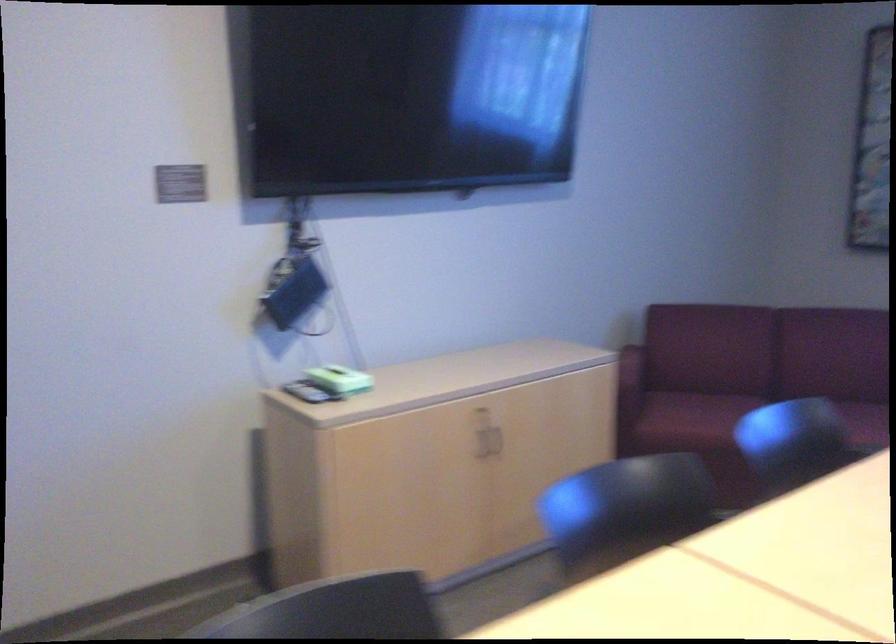
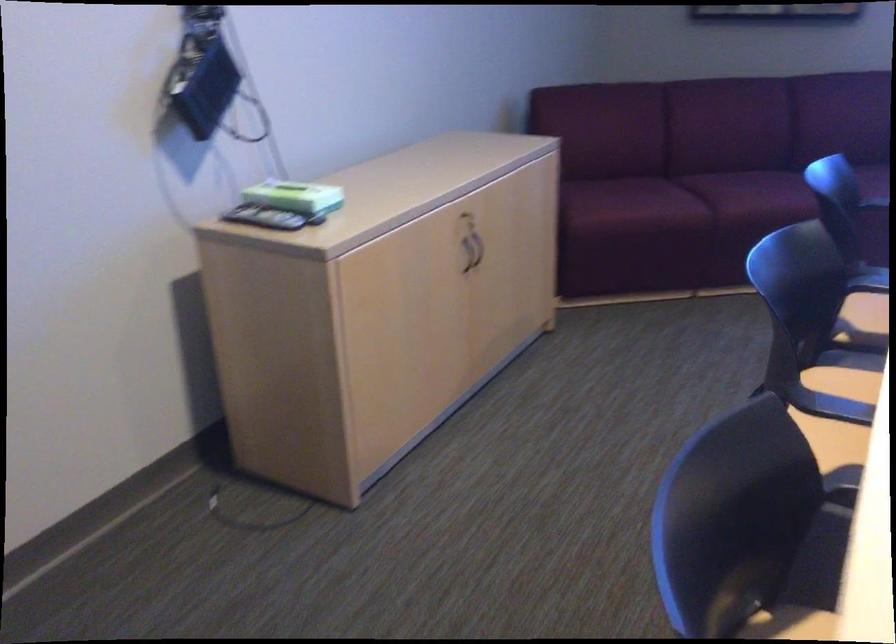
The point at [298,389] is marked in the first image. Where is the corresponding point in the second image?

(263, 218)